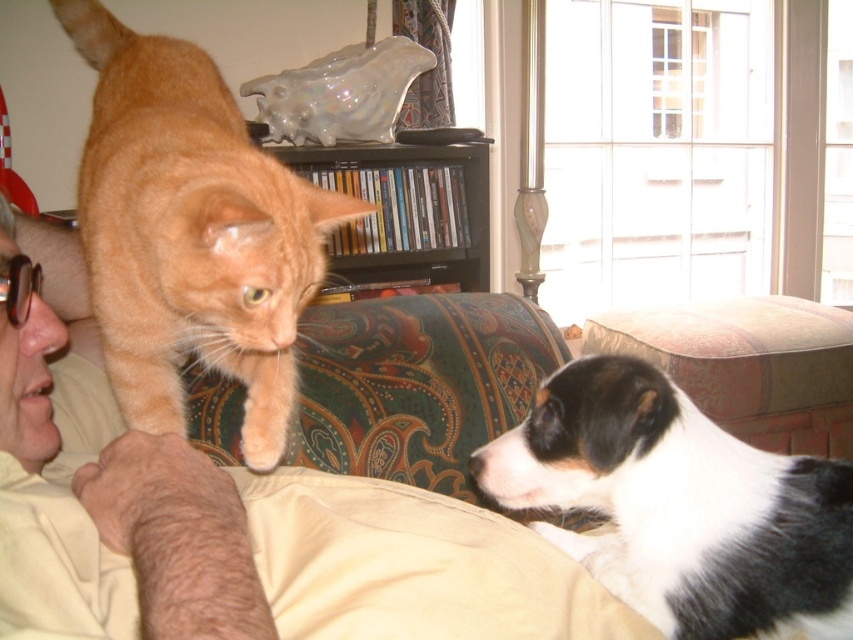
You are a photographer taking a picture of the beige cotton shirt at upper left and the black and white fur at lower right. Which object will appear closer to the camera in the photo?

The beige cotton shirt at upper left will appear closer to the camera in the photo because it is in front of the black and white fur at lower right.

You are a delivery robot entering the living room and need to place a small package on the object that takes up more space. Which object should you choose between the black and white fur at lower right and the black glossy bookshelf at upper center?

The black glossy bookshelf at upper center takes up more space than the black and white fur at lower right, so you should place the package on the black glossy bookshelf at upper center.

You are a photographer trying to capture a candid shot of the beige cotton shirt at upper left and the black and white fur at lower right. Since you want to ensure both subjects are in focus, you need to know their sizes. Which object is larger?

The beige cotton shirt at upper left is larger than the black and white fur at lower right, so you should adjust your camera settings to accommodate the size difference for better focus.